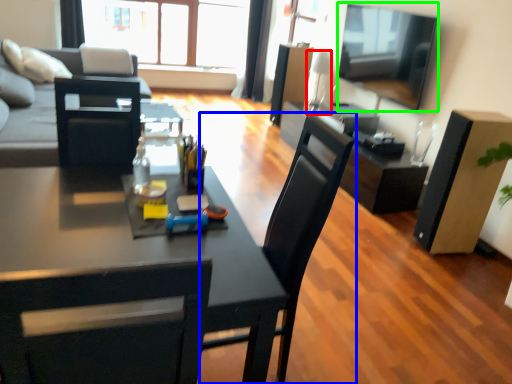
Question: Based on their relative distances, which object is farther from lamp (highlighted by a red box)? Choose from chair (highlighted by a blue box) and television (highlighted by a green box).

Choices:
 (A) chair
 (B) television

Answer: (A)